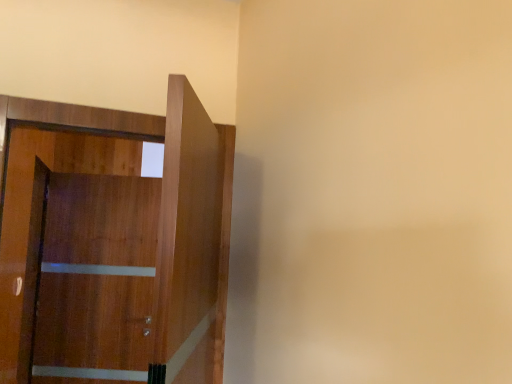
The image size is (512, 384). What do you see at coordinates (97, 280) in the screenshot?
I see `wooden barn door at left` at bounding box center [97, 280].

What is the approximate height of wooden barn door at left?

4.85 feet.

Locate an element on the screen. wooden barn door at left is located at coordinates (97, 280).

The image size is (512, 384). What do you see at coordinates (113, 244) in the screenshot?
I see `wooden door at left` at bounding box center [113, 244].

You are a GUI agent. You are given a task and a screenshot of the screen. Output one action in this format:
    pyautogui.click(x=<x>, y=<y>)
    Task: Click on the wooden door at left
    This screenshot has width=512, height=384.
    Given the screenshot: What is the action you would take?
    pyautogui.click(x=113, y=244)

Identify the location of wooden barn door at left. The height and width of the screenshot is (384, 512). (97, 280).

Considering the relative positions of wooden barn door at left and wooden door at left in the image provided, is wooden barn door at left to the left or to the right of wooden door at left?

Based on their positions, wooden barn door at left is located to the left of wooden door at left.

Considering their positions, is wooden barn door at left located in front of or behind wooden door at left?

Visually, wooden barn door at left is located behind wooden door at left.

Which is farther from the camera, (133, 349) or (51, 183)?

The point (51, 183) is farther.

From the image's perspective, which object appears higher, wooden barn door at left or wooden door at left?

From the image's view, wooden door at left is above.

In the scene shown: From a real-world perspective, is wooden barn door at left located higher than wooden door at left?

No, from a real-world perspective, wooden barn door at left is not over wooden door at left

Does wooden barn door at left have a lesser width compared to wooden door at left?

Correct, the width of wooden barn door at left is less than that of wooden door at left.

Considering the sizes of wooden barn door at left and wooden door at left in the image, is wooden barn door at left taller or shorter than wooden door at left?

Considering their sizes, wooden barn door at left has more height than wooden door at left.

Which of these two, wooden barn door at left or wooden door at left, is smaller?

wooden door at left.

Looking at this image, is wooden door at left a part of wooden barn door at left?

That's incorrect, wooden door at left is not inside wooden barn door at left.

Can you see wooden barn door at left touching wooden door at left?

Indeed, wooden barn door at left and wooden door at left are beside each other and touching.

Is wooden barn door at left oriented away from wooden door at left?

wooden barn door at left does not have its back to wooden door at left.

What's the angular difference between wooden barn door at left and wooden door at left's facing directions?

19.8 degrees separate the facing orientations of wooden barn door at left and wooden door at left.

What are the coordinates of `door above the wooden barn door at left (from a real-world perspective)` in the screenshot? It's located at (113, 244).

Is wooden door at left to the right of wooden barn door at left from the viewer's perspective?

Yes, wooden door at left is to the right of wooden barn door at left.

Considering the positions of objects wooden door at left and wooden barn door at left in the image provided, who is behind, wooden door at left or wooden barn door at left?

wooden barn door at left is behind.

Between point (67, 376) and point (71, 259), which one is positioned behind?

Point (71, 259)

From the image's perspective, is wooden door at left under wooden barn door at left?

No.

From a real-world perspective, between wooden door at left and wooden barn door at left, who is vertically lower?

From a 3D spatial view, wooden barn door at left is below.

From the picture: Considering the relative sizes of wooden door at left and wooden barn door at left in the image provided, is wooden door at left wider than wooden barn door at left?

Yes.

Does wooden door at left have a lesser height compared to wooden barn door at left?

Yes.

Which of these two, wooden door at left or wooden barn door at left, is smaller?

With smaller size is wooden door at left.

Is wooden barn door at left a part of wooden door at left?

No, wooden barn door at left is not surrounded by wooden door at left.

Is there a large distance between wooden door at left and wooden barn door at left?

No.

Is wooden door at left positioned with its back to wooden barn door at left?

Yes, wooden barn door at left is at the back of wooden door at left.

How far apart are wooden door at left and wooden barn door at left?

The distance of wooden door at left from wooden barn door at left is 1.33 inches.

Where is `barn door behind the wooden door at left`? barn door behind the wooden door at left is located at coordinates (97, 280).

Where is `barn door behind the wooden door at left`? This screenshot has height=384, width=512. barn door behind the wooden door at left is located at coordinates (97, 280).

Locate an element on the screen. door that appears on the right of wooden barn door at left is located at coordinates (113, 244).